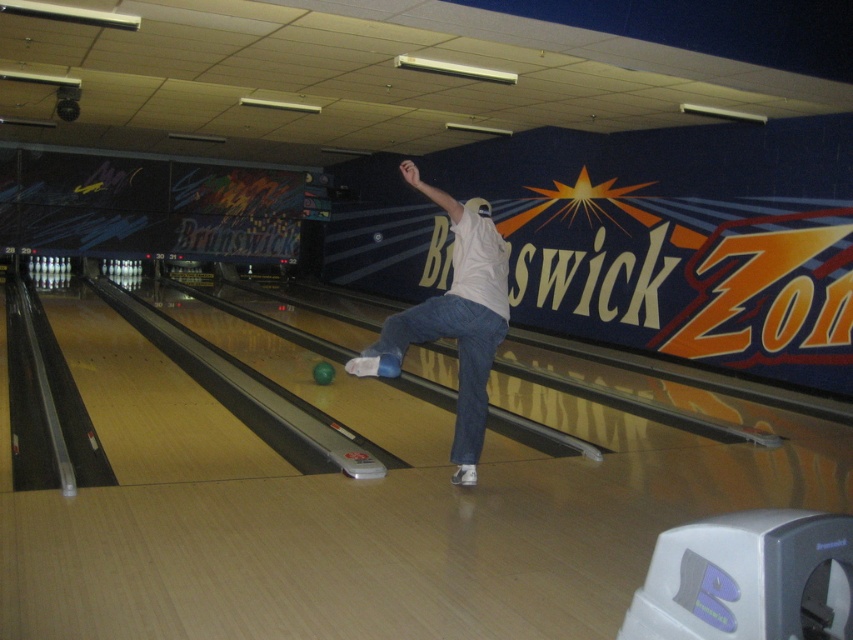
Is white matte shirt at center below blue denim jeans at center?

Actually, white matte shirt at center is above blue denim jeans at center.

Does white matte shirt at center appear on the right side of blue denim jeans at center?

Incorrect, white matte shirt at center is not on the right side of blue denim jeans at center.

The height and width of the screenshot is (640, 853). What are the coordinates of `white matte shirt at center` in the screenshot? It's located at (454, 320).